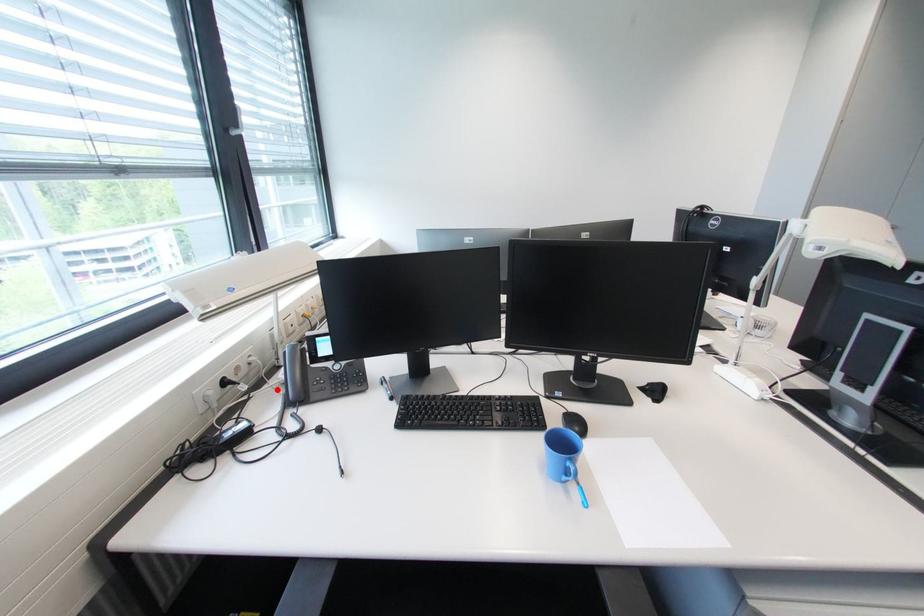
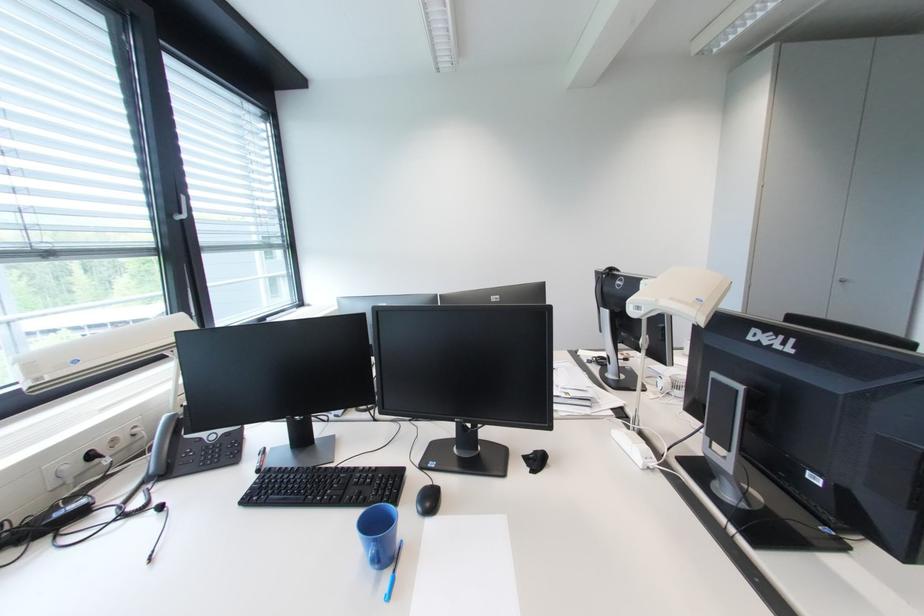
Find the pixel in the second image that matches the highlighted location in the first image.

(151, 464)